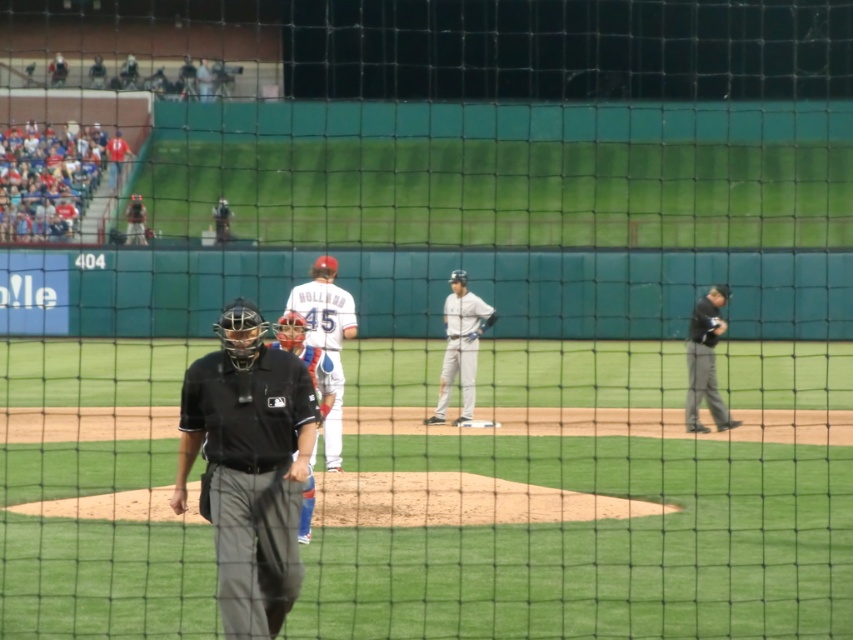
Question: Which point is closer to the camera?

Choices:
 (A) matte black umpire at upper center
 (B) black matte umpire at center
 (C) matte black helmet at upper center

Answer: (B)

Question: Is matte black umpire at upper center positioned before white uniformed man at upper left?

Choices:
 (A) yes
 (B) no

Answer: (A)

Question: Which point is farther to the camera?

Choices:
 (A) (123, 65)
 (B) (256, 630)

Answer: (A)

Question: Can you confirm if black matte umpire at center is bigger than white jersey at upper left?

Choices:
 (A) no
 (B) yes

Answer: (B)

Question: Considering the relative positions of matte black umpire at upper center and white jersey at upper left in the image provided, where is matte black umpire at upper center located with respect to white jersey at upper left?

Choices:
 (A) left
 (B) right

Answer: (B)

Question: Among these points, which one is nearest to the camera?

Choices:
 (A) click(49, 68)
 (B) click(96, 170)

Answer: (B)